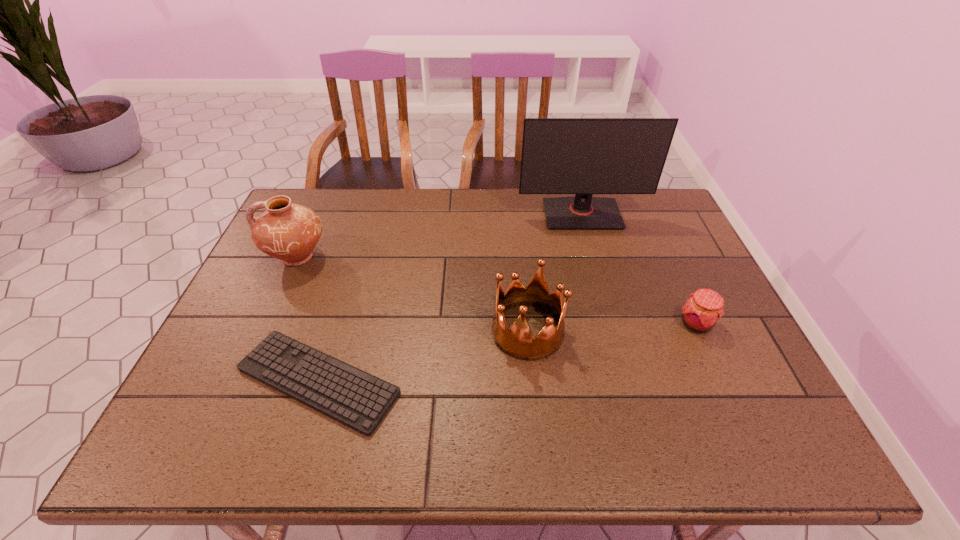
Identify the location of monitor. (583, 156).

Image resolution: width=960 pixels, height=540 pixels. In order to click on the tallest object in this screenshot , I will do `click(583, 156)`.

The width and height of the screenshot is (960, 540). I want to click on the second farthest object, so pos(286,231).

This screenshot has height=540, width=960. What are the coordinates of `crown` in the screenshot? It's located at (518, 342).

You are a GUI agent. You are given a task and a screenshot of the screen. Output one action in this format:
    pyautogui.click(x=<x>, y=<y>)
    Task: Click on the fourth tallest object
    
    Given the screenshot: What is the action you would take?
    pyautogui.click(x=704, y=308)

Image resolution: width=960 pixels, height=540 pixels. I want to click on the shortest object, so click(351, 396).

Image resolution: width=960 pixels, height=540 pixels. I want to click on vacant space located 0.150m on the screen side of the tallest object, so click(595, 262).

You are a GUI agent. You are given a task and a screenshot of the screen. Output one action in this format:
    pyautogui.click(x=<x>, y=<y>)
    Task: Click on the free space located on the right of the crown
    This screenshot has width=960, height=540.
    Given the screenshot: What is the action you would take?
    pyautogui.click(x=619, y=331)

Where is `vacant area situated on the front of the second shortest object`? This screenshot has height=540, width=960. vacant area situated on the front of the second shortest object is located at coordinates (722, 380).

You are a GUI agent. You are given a task and a screenshot of the screen. Output one action in this format:
    pyautogui.click(x=<x>, y=<y>)
    Task: Click on the free space located 0.230m on the back of the computer keyboard
    
    Given the screenshot: What is the action you would take?
    pyautogui.click(x=351, y=271)